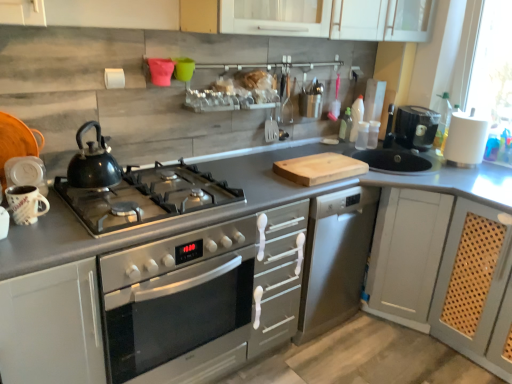
Question: Is white matte cabinet at lower left, placed as the second cabinetry when sorted from right to left, at the left side of matte ceramic mug at left, which is the 2th appliance from right to left?

Choices:
 (A) no
 (B) yes

Answer: (B)

Question: From a real-world perspective, does white matte cabinet at lower left, placed as the second cabinetry when sorted from right to left, stand above matte ceramic mug at left, which is the 2th appliance from right to left?

Choices:
 (A) yes
 (B) no

Answer: (B)

Question: Considering the relative sizes of white matte cabinet at lower left, placed as the second cabinetry when sorted from right to left, and matte ceramic mug at left, the 1th appliance from the left, in the image provided, is white matte cabinet at lower left, placed as the second cabinetry when sorted from right to left, wider than matte ceramic mug at left, the 1th appliance from the left,?

Choices:
 (A) yes
 (B) no

Answer: (A)

Question: Is white matte cabinet at lower left, placed as the second cabinetry when sorted from right to left, oriented towards matte ceramic mug at left, which is the 2th appliance from right to left?

Choices:
 (A) no
 (B) yes

Answer: (A)

Question: From the image's perspective, does white matte cabinet at lower left, placed as the second cabinetry when sorted from right to left, appear higher than matte ceramic mug at left, which is the 1th appliance in bottom-to-top order?

Choices:
 (A) yes
 (B) no

Answer: (B)

Question: Can you confirm if white matte cabinet at lower left, placed as the second cabinetry when sorted from right to left, is bigger than matte ceramic mug at left, which is the 2th appliance from right to left?

Choices:
 (A) yes
 (B) no

Answer: (A)

Question: From the image's perspective, does white matte cabinet at lower left, which is the 1th cabinetry from left to right, appear higher than black plastic coffee machine at right?

Choices:
 (A) no
 (B) yes

Answer: (A)

Question: Can you confirm if white matte cabinet at lower left, placed as the second cabinetry when sorted from right to left, is wider than black plastic coffee machine at right?

Choices:
 (A) no
 (B) yes

Answer: (B)

Question: Is the depth of white matte cabinet at lower left, placed as the second cabinetry when sorted from right to left, less than that of black plastic coffee machine at right?

Choices:
 (A) yes
 (B) no

Answer: (A)

Question: Are white matte cabinet at lower left, placed as the second cabinetry when sorted from right to left, and black plastic coffee machine at right far apart?

Choices:
 (A) no
 (B) yes

Answer: (B)

Question: Is white matte cabinet at lower left, placed as the second cabinetry when sorted from right to left, facing away from black plastic coffee machine at right?

Choices:
 (A) yes
 (B) no

Answer: (B)

Question: Does white matte cabinet at lower left, which is the 1th cabinetry from left to right, come behind black plastic coffee machine at right?

Choices:
 (A) yes
 (B) no

Answer: (B)

Question: Is matte gray cabinet at right, arranged as the 2th cabinetry when viewed from the left, at the right side of white matte cabinet at lower left, placed as the second cabinetry when sorted from right to left?

Choices:
 (A) no
 (B) yes

Answer: (B)